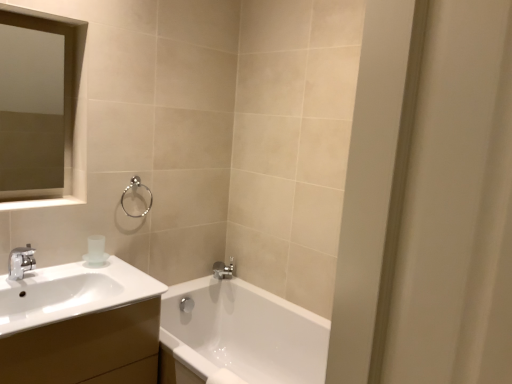
Question: Can you confirm if matte glass medicine cabinet at upper left is thinner than white glossy balustrade at upper left?

Choices:
 (A) yes
 (B) no

Answer: (A)

Question: Is white glossy balustrade at upper left located within matte glass medicine cabinet at upper left?

Choices:
 (A) yes
 (B) no

Answer: (B)

Question: From the image's perspective, is matte glass medicine cabinet at upper left located above white glossy balustrade at upper left?

Choices:
 (A) yes
 (B) no

Answer: (A)

Question: Considering the relative sizes of matte glass medicine cabinet at upper left and white glossy balustrade at upper left in the image provided, is matte glass medicine cabinet at upper left bigger than white glossy balustrade at upper left?

Choices:
 (A) no
 (B) yes

Answer: (B)

Question: Is matte glass medicine cabinet at upper left smaller than white glossy balustrade at upper left?

Choices:
 (A) no
 (B) yes

Answer: (A)

Question: Does matte glass medicine cabinet at upper left have a greater height compared to white glossy balustrade at upper left?

Choices:
 (A) no
 (B) yes

Answer: (B)

Question: Does white glossy balustrade at upper left have a lesser height compared to white glossy cabinet at left?

Choices:
 (A) yes
 (B) no

Answer: (A)

Question: Is white glossy balustrade at upper left at the right side of white glossy cabinet at left?

Choices:
 (A) no
 (B) yes

Answer: (A)

Question: From the image's perspective, is white glossy balustrade at upper left beneath white glossy cabinet at left?

Choices:
 (A) no
 (B) yes

Answer: (A)

Question: From the image's perspective, does white glossy balustrade at upper left appear higher than white glossy cabinet at left?

Choices:
 (A) no
 (B) yes

Answer: (B)

Question: Does white glossy balustrade at upper left have a greater height compared to white glossy cabinet at left?

Choices:
 (A) no
 (B) yes

Answer: (A)

Question: Is white glossy balustrade at upper left located outside white glossy cabinet at left?

Choices:
 (A) no
 (B) yes

Answer: (B)

Question: Is transparent frosted glass cup at upper left bigger than white glossy balustrade at upper left?

Choices:
 (A) no
 (B) yes

Answer: (A)